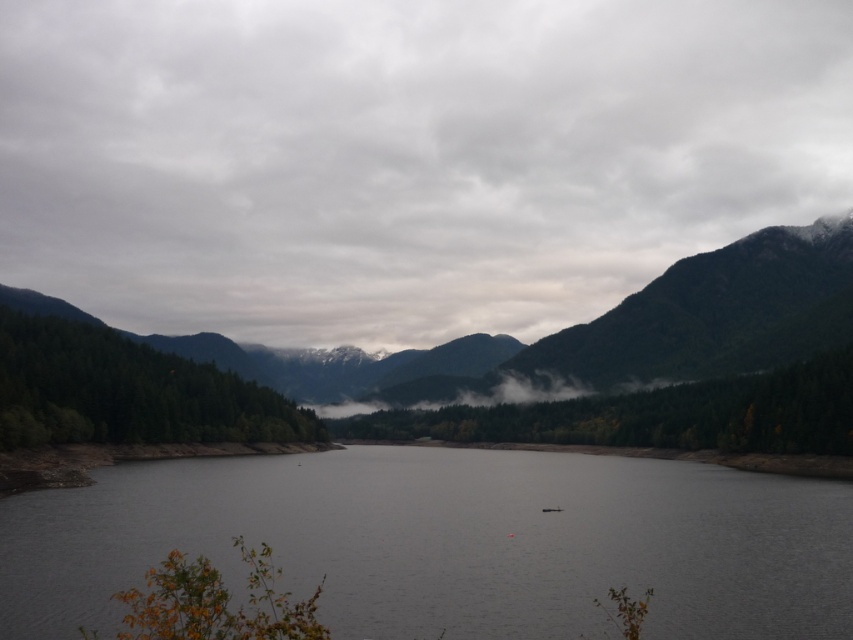
Can you confirm if gray water at center is positioned to the left of green matte forest at center?

Correct, you'll find gray water at center to the left of green matte forest at center.

Does gray water at center have a lesser width compared to green matte forest at center?

Indeed, gray water at center has a lesser width compared to green matte forest at center.

You are a GUI agent. You are given a task and a screenshot of the screen. Output one action in this format:
    pyautogui.click(x=<x>, y=<y>)
    Task: Click on the gray water at center
    
    Given the screenshot: What is the action you would take?
    448,541

In the scene shown: Who is more forward, (196, 61) or (74, 413)?

Point (74, 413) is more forward.

Based on the photo, can you confirm if cloudy sky at upper center is smaller than green matte forest at left?

No.

Describe the element at coordinates (403, 156) in the screenshot. I see `cloudy sky at upper center` at that location.

Locate an element on the screen. The height and width of the screenshot is (640, 853). cloudy sky at upper center is located at coordinates (403, 156).

Does gray water at center appear under green matte forest at left?

Yes.

You are a GUI agent. You are given a task and a screenshot of the screen. Output one action in this format:
    pyautogui.click(x=<x>, y=<y>)
    Task: Click on the gray water at center
    This screenshot has height=640, width=853.
    Given the screenshot: What is the action you would take?
    click(448, 541)

Where is `gray water at center`? This screenshot has width=853, height=640. gray water at center is located at coordinates (448, 541).